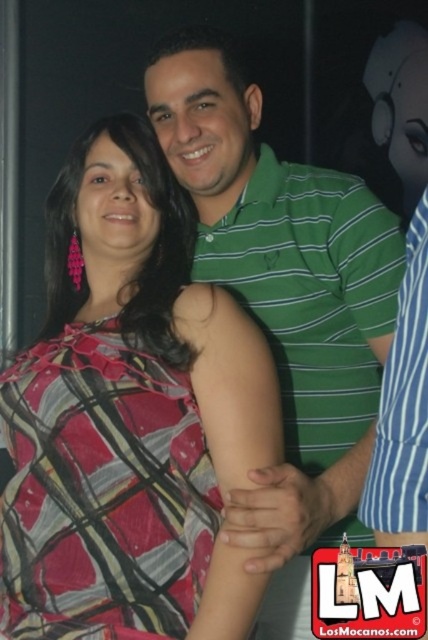
You are standing in front of the photograph and want to touch the point that is closer to you. Which point should you choose between point (x=222, y=422) and point (x=397, y=483)?

Point (x=222, y=422) is further to the viewer than point (x=397, y=483), so you should choose point (x=222, y=422) as it is closer to you.

You are a photographer trying to adjust the lighting for a photo shoot. You notice the plaid fabric dress at center and the green striped polo shirt at center. Which clothing item is positioned lower in the frame?

The plaid fabric dress at center is located below the green striped polo shirt at center, so it is positioned lower in the frame.

You are a photographer trying to frame a photo of the plaid fabric dress at center and the green striped shirt at right. Since you want to highlight both subjects equally, which clothing item should you adjust the camera focus on to ensure proper exposure, considering their sizes?

The plaid fabric dress at center is bigger than the green striped shirt at right, so you should focus on the plaid fabric dress at center to ensure proper exposure since it takes up more space in the frame.